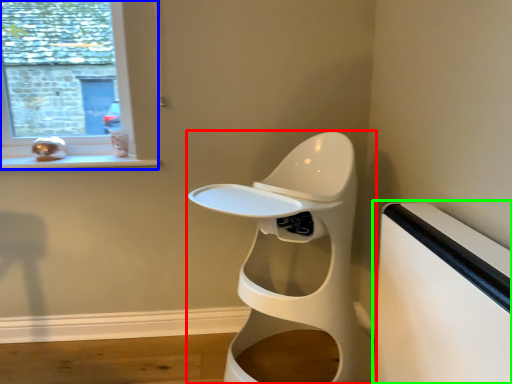
Question: Which object is positioned farthest from toilet (highlighted by a red box)? Select from window (highlighted by a blue box) and table (highlighted by a green box).

Choices:
 (A) window
 (B) table

Answer: (A)